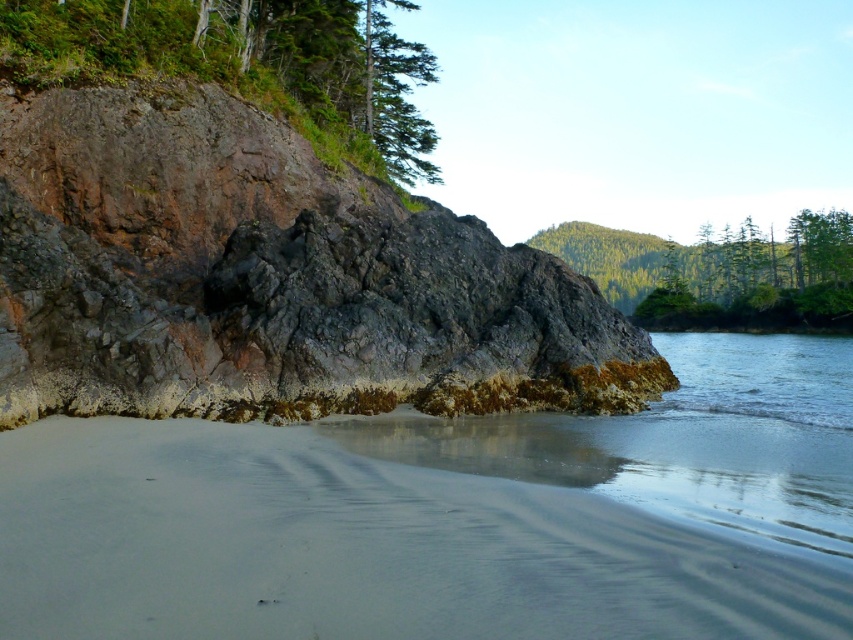
Is point (65, 408) positioned after point (758, 404)?

No, it is not.

In the scene shown: Can you confirm if rusty stone cliff at center-left is shorter than clear water at lower right?

No.

Who is more distant from viewer, (450, 211) or (688, 349)?

Point (688, 349)

You are a GUI agent. You are given a task and a screenshot of the screen. Output one action in this format:
    pyautogui.click(x=<x>, y=<y>)
    Task: Click on the rusty stone cliff at center-left
    The width and height of the screenshot is (853, 640).
    Given the screenshot: What is the action you would take?
    pos(267,278)

Who is higher up, rusty stone cliff at center-left or sandy beach at lower left?

Positioned higher is rusty stone cliff at center-left.

Is rusty stone cliff at center-left positioned behind sandy beach at lower left?

Yes, it is behind sandy beach at lower left.

Is point (325, 196) in front of point (589, 557)?

That is False.

The width and height of the screenshot is (853, 640). Find the location of `rusty stone cliff at center-left`. rusty stone cliff at center-left is located at coordinates (267, 278).

Does rusty stone cliff at center-left have a lesser height compared to green textured tree at upper center?

Indeed, rusty stone cliff at center-left has a lesser height compared to green textured tree at upper center.

Describe the element at coordinates (267, 278) in the screenshot. I see `rusty stone cliff at center-left` at that location.

Where is `rusty stone cliff at center-left`? The height and width of the screenshot is (640, 853). rusty stone cliff at center-left is located at coordinates coord(267,278).